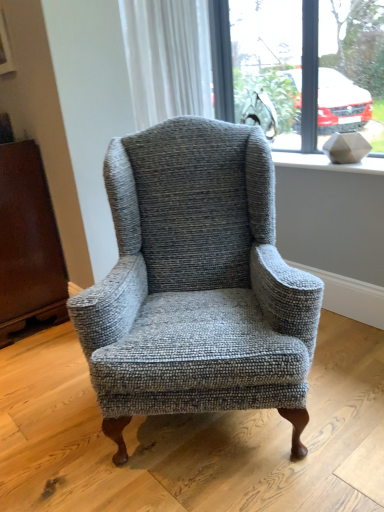
Question: Relative to clear glass window at upper center, is textured gray armchair at center in front or behind?

Choices:
 (A) behind
 (B) front

Answer: (B)

Question: Choose the correct answer: Is textured gray armchair at center inside clear glass window at upper center or outside it?

Choices:
 (A) inside
 (B) outside

Answer: (B)

Question: Which of these objects is positioned farthest from the brown leather armoire at left?

Choices:
 (A) white textured curtain at upper center
 (B) clear glass window at upper center
 (C) white textured stone at upper right
 (D) textured gray armchair at center

Answer: (B)

Question: Which object is the closest to the brown leather armoire at left?

Choices:
 (A) white textured stone at upper right
 (B) clear glass window at upper center
 (C) white textured curtain at upper center
 (D) textured gray armchair at center

Answer: (C)